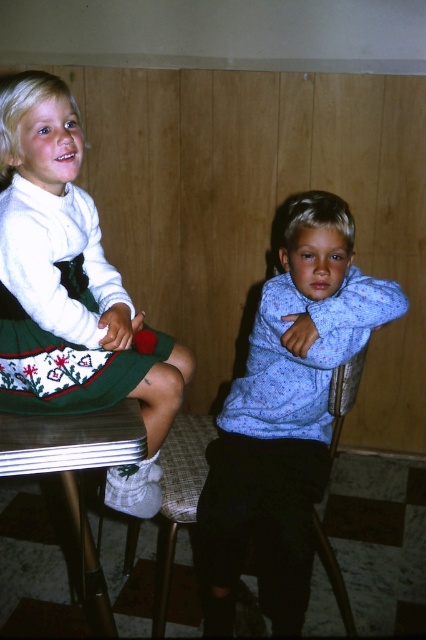
You are a tailor measuring fabrics for alterations. You have a piece of fabric that is exactly the same size as the matte green skirt at left. Can you use this fabric to make a new blue speckled sweater at center without needing extra material?

The blue speckled sweater at center is larger in size than the matte green skirt at left. Since the fabric provided matches the size of the matte green skirt at left, it would not be sufficient to create the larger blue speckled sweater at center without additional material.

Looking at this image, you are a photographer setting up a shoot in the room where the two children are sitting. You need to place a small prop on the metallic silver table at lower left. However, the green knitted dress at upper left is currently covering part of it. Can you place the prop on the table without moving the dress?

The green knitted dress at upper left is positioned over the metallic silver table at lower left, so placing the prop without moving the dress is not possible because the dress is covering part of the table.